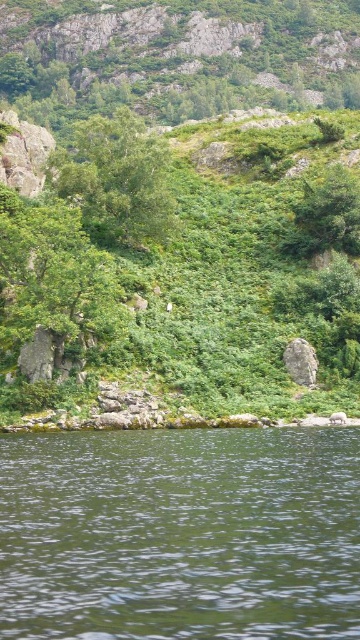
Question: Can you confirm if green liquid water at bottom is positioned above green leafy tree at upper center?

Choices:
 (A) no
 (B) yes

Answer: (A)

Question: Where is green leafy tree at left located in relation to green leafy tree at upper center in the image?

Choices:
 (A) right
 (B) left

Answer: (A)

Question: Which point appears farthest from the camera in this image?

Choices:
 (A) (45, 582)
 (B) (23, 243)
 (C) (159, 168)

Answer: (C)

Question: Among these points, which one is farthest from the camera?

Choices:
 (A) (101, 211)
 (B) (24, 316)

Answer: (A)

Question: Which point appears closest to the camera in this image?

Choices:
 (A) (117, 564)
 (B) (69, 310)

Answer: (A)

Question: Does green liquid water at bottom have a smaller size compared to green leafy tree at upper center?

Choices:
 (A) yes
 (B) no

Answer: (A)